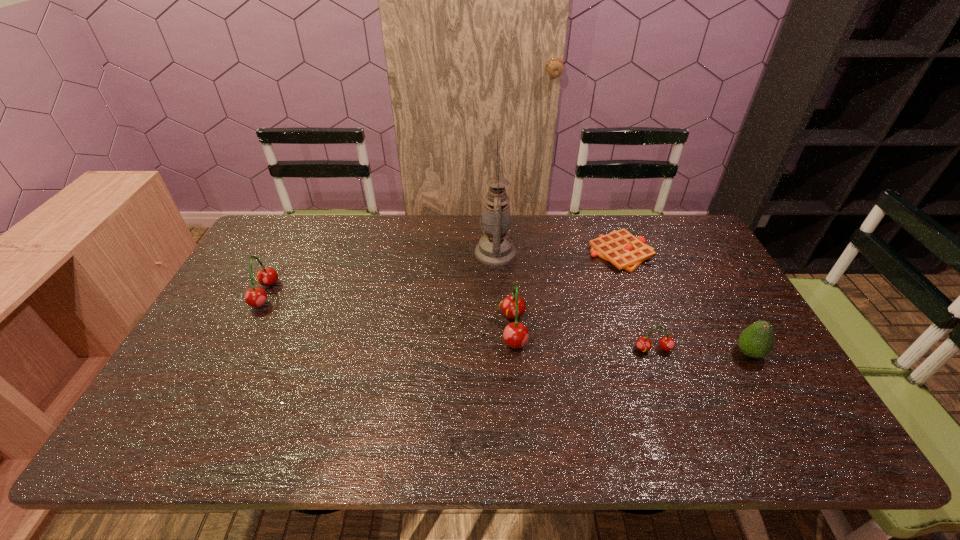
Find the location of a particular element. the third tallest object is located at coordinates (255, 297).

The height and width of the screenshot is (540, 960). In order to click on the second tallest cherry in this screenshot , I will do `click(255, 297)`.

The height and width of the screenshot is (540, 960). Identify the location of the second cherry from left to right. (515, 335).

Identify the location of the shortest cherry. The height and width of the screenshot is (540, 960). (666, 343).

Find the location of a particular element. The image size is (960, 540). the rightmost cherry is located at coordinates (666, 343).

You are a GUI agent. You are given a task and a screenshot of the screen. Output one action in this format:
    pyautogui.click(x=<x>, y=<y>)
    Task: Click on the oil lamp
    The width and height of the screenshot is (960, 540).
    Given the screenshot: What is the action you would take?
    pyautogui.click(x=495, y=248)

Locate an element on the screen. Image resolution: width=960 pixels, height=540 pixels. waffle is located at coordinates (625, 251).

Find the location of a particular element. This screenshot has width=960, height=540. the rightmost object is located at coordinates (756, 341).

Locate an element on the screen. avocado is located at coordinates (756, 341).

What are the coordinates of `vacant space situated 0.090m with stems pointing upwards on the third tallest object` in the screenshot? It's located at (224, 294).